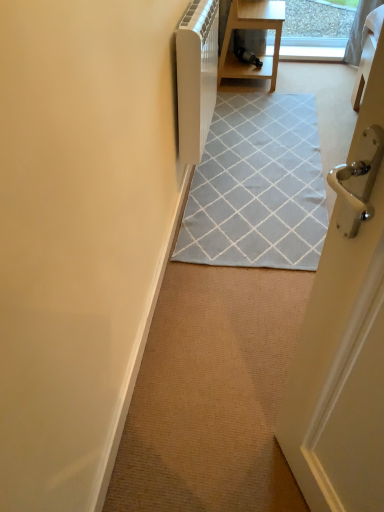
Question: Is white plastic radiator at upper center shorter than wooden table at upper center?

Choices:
 (A) yes
 (B) no

Answer: (B)

Question: Could you tell me if white plastic radiator at upper center is facing wooden table at upper center?

Choices:
 (A) no
 (B) yes

Answer: (A)

Question: Is white plastic radiator at upper center to the right of wooden table at upper center from the viewer's perspective?

Choices:
 (A) no
 (B) yes

Answer: (A)

Question: Is white plastic radiator at upper center in contact with wooden table at upper center?

Choices:
 (A) no
 (B) yes

Answer: (A)

Question: Is white plastic radiator at upper center taller than wooden table at upper center?

Choices:
 (A) no
 (B) yes

Answer: (B)

Question: Is white plastic radiator at upper center closer to the viewer compared to wooden table at upper center?

Choices:
 (A) no
 (B) yes

Answer: (B)

Question: Is wooden table at upper center smaller than white plastic radiator at upper center?

Choices:
 (A) no
 (B) yes

Answer: (A)

Question: Is wooden table at upper center looking in the opposite direction of white plastic radiator at upper center?

Choices:
 (A) yes
 (B) no

Answer: (B)

Question: Can white plastic radiator at upper center be found inside wooden table at upper center?

Choices:
 (A) no
 (B) yes

Answer: (A)

Question: Does wooden table at upper center come behind white plastic radiator at upper center?

Choices:
 (A) no
 (B) yes

Answer: (B)

Question: Considering the relative positions of wooden table at upper center and white plastic radiator at upper center in the image provided, is wooden table at upper center to the left of white plastic radiator at upper center from the viewer's perspective?

Choices:
 (A) yes
 (B) no

Answer: (B)

Question: From a real-world perspective, does wooden table at upper center sit lower than white plastic radiator at upper center?

Choices:
 (A) no
 (B) yes

Answer: (B)

Question: Is light gray woven rug at center bigger than wooden table at upper center?

Choices:
 (A) no
 (B) yes

Answer: (A)